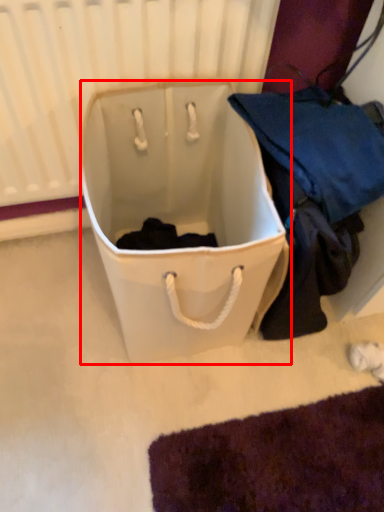
Question: In this image, where is luggage and bags (annotated by the red box) located relative to radiator?

Choices:
 (A) left
 (B) right

Answer: (B)